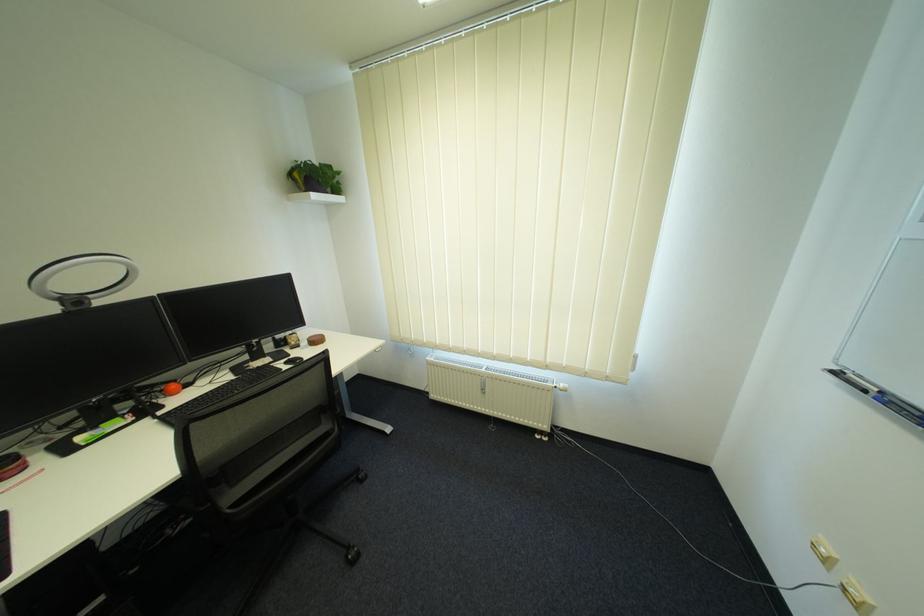
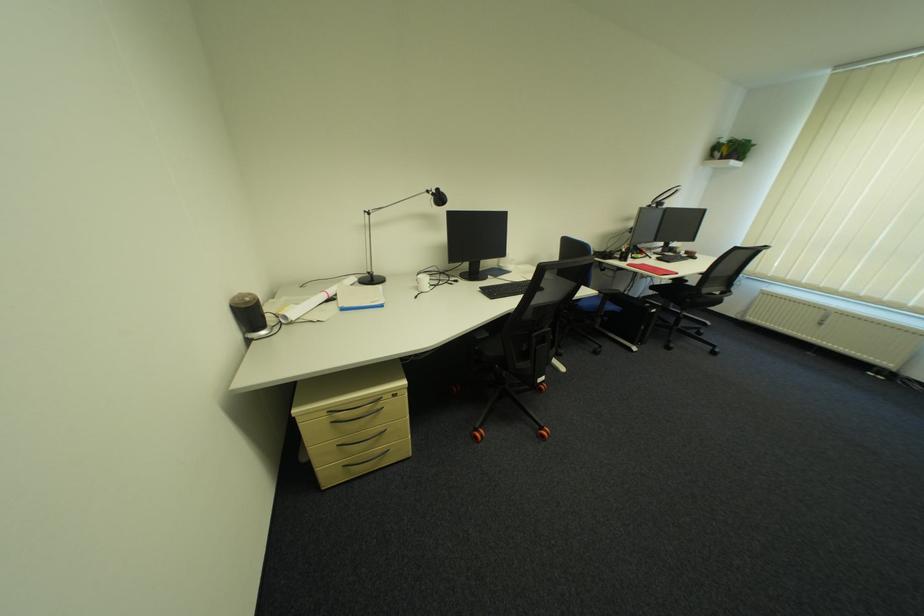
The point at [302,344] is marked in the first image. Where is the corresponding point in the second image?

(687, 252)